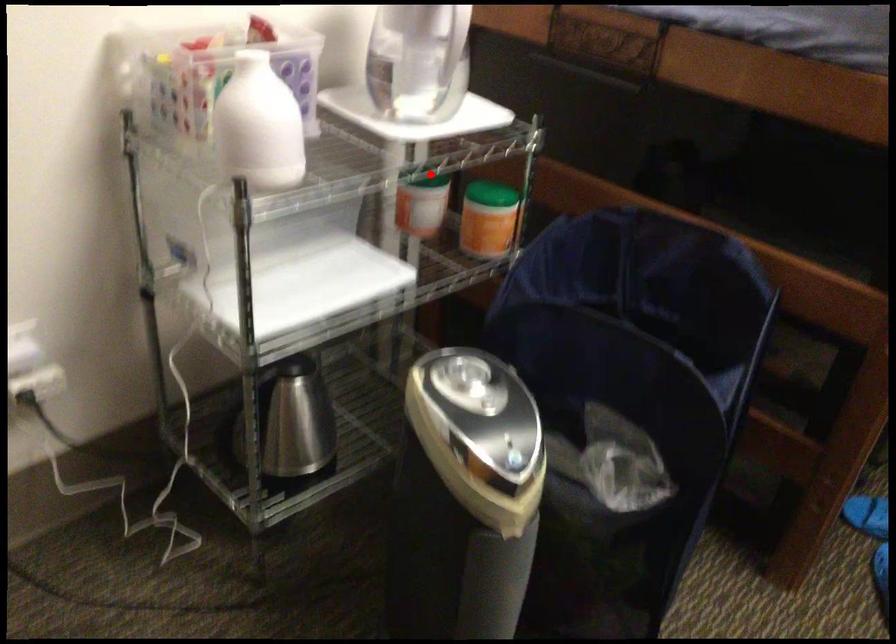
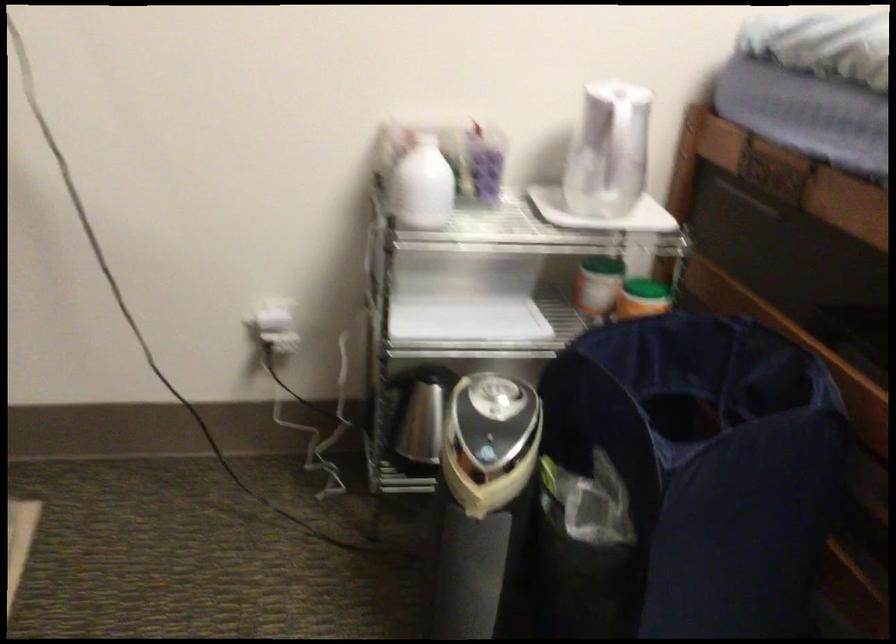
Question: I am providing you with two images of the same scene from different viewpoints. A red point is shown in image1. For the corresponding object point in image2, is it positioned nearer or farther from the camera?

Choices:
 (A) Nearer
 (B) Farther

Answer: (B)